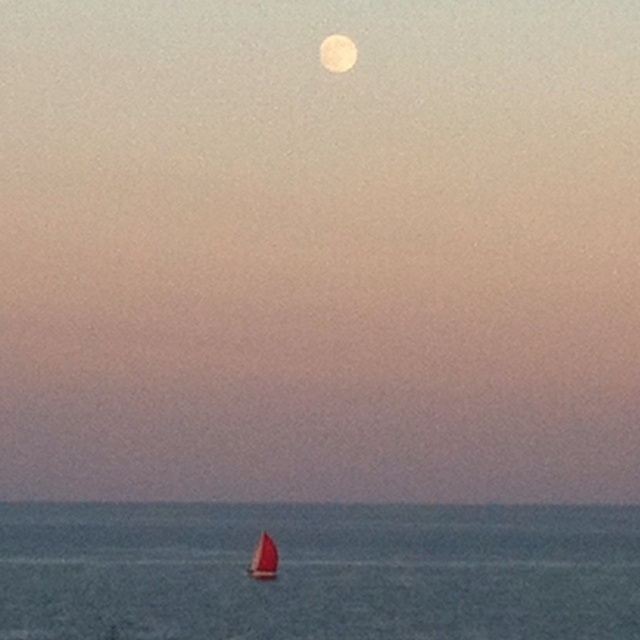
Which is behind, point (340, 35) or point (264, 568)?

The point (340, 35) is more distant.

In the scene shown: Who is taller, smooth white moon at upper center or red sailboat at lower center?

Standing taller between the two is smooth white moon at upper center.

At what (x,y) coordinates should I click in order to perform the action: click on smooth white moon at upper center. Please return your answer as a coordinate pair (x, y). Looking at the image, I should click on (337, 52).

Where is `smooth white moon at upper center`? The height and width of the screenshot is (640, 640). smooth white moon at upper center is located at coordinates (337, 52).

Who is higher up, blue water at center or red sailboat at lower center?

red sailboat at lower center

Does blue water at center have a larger size compared to red sailboat at lower center?

Yes, blue water at center is bigger than red sailboat at lower center.

Does point (67, 609) lie in front of point (269, 561)?

Yes, it is.

Image resolution: width=640 pixels, height=640 pixels. Identify the location of blue water at center. (317, 572).

Can you confirm if blue water at center is shorter than smooth white moon at upper center?

No, blue water at center is not shorter than smooth white moon at upper center.

Is blue water at center thinner than smooth white moon at upper center?

Incorrect, blue water at center's width is not less than smooth white moon at upper center's.

Where is `blue water at center`? blue water at center is located at coordinates (317, 572).

Where is `blue water at center`? The width and height of the screenshot is (640, 640). blue water at center is located at coordinates (317, 572).